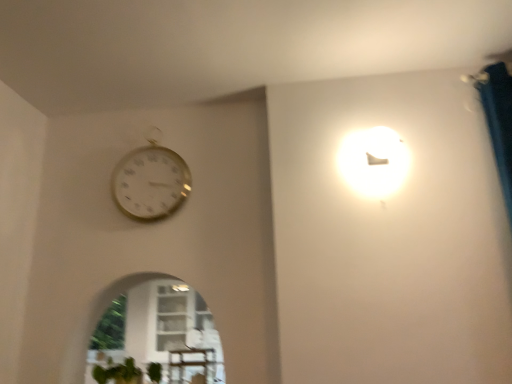
Question: Considering the positions of wooden table at lower center and gold metallic wall clock at upper left in the image, is wooden table at lower center bigger or smaller than gold metallic wall clock at upper left?

Choices:
 (A) big
 (B) small

Answer: (B)

Question: Choose the correct answer: Is wooden table at lower center inside gold metallic wall clock at upper left or outside it?

Choices:
 (A) inside
 (B) outside

Answer: (B)

Question: Which object is positioned closest to the green matte plant at lower left?

Choices:
 (A) wooden table at lower center
 (B) gold metallic wall clock at upper left

Answer: (A)

Question: Considering the real-world distances, which object is farthest from the wooden table at lower center?

Choices:
 (A) gold metallic wall clock at upper left
 (B) green matte plant at lower left

Answer: (A)